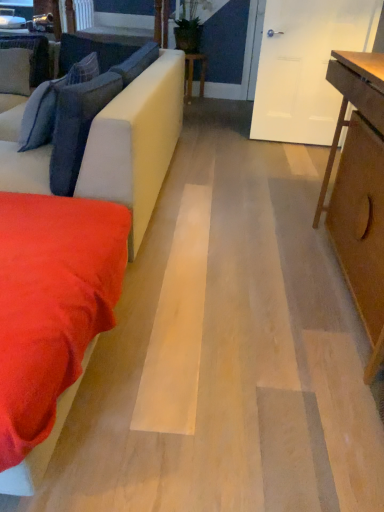
You are a GUI agent. You are given a task and a screenshot of the screen. Output one action in this format:
    pyautogui.click(x=<x>, y=<y>)
    Task: Click on the free spot behind light brown wooden table at right, marked as the second table in a back-to-front arrangement
    Image resolution: width=384 pixels, height=512 pixels.
    Given the screenshot: What is the action you would take?
    pyautogui.click(x=261, y=183)